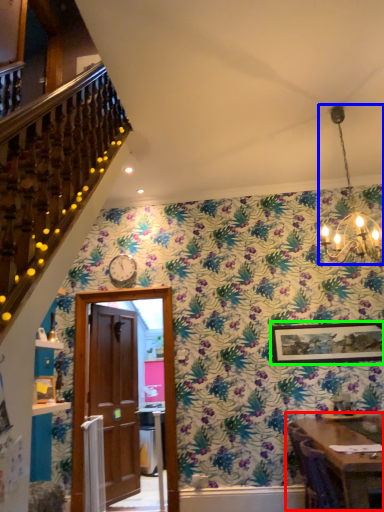
Question: Which is nearer to the table (highlighted by a red box)? light fixture (highlighted by a blue box) or picture frame (highlighted by a green box).

Choices:
 (A) light fixture
 (B) picture frame

Answer: (B)